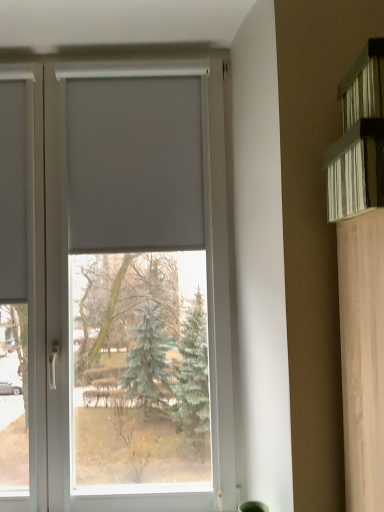
Question: Does white matte blind at center lie in front of white textured shelf at upper right?

Choices:
 (A) no
 (B) yes

Answer: (A)

Question: Is white matte blind at center touching white textured shelf at upper right?

Choices:
 (A) no
 (B) yes

Answer: (A)

Question: Is white matte blind at center not near white textured shelf at upper right?

Choices:
 (A) no
 (B) yes

Answer: (A)

Question: Is white matte blind at center completely or partially outside of white textured shelf at upper right?

Choices:
 (A) no
 (B) yes

Answer: (B)

Question: From the image's perspective, does white matte blind at center appear higher than white textured shelf at upper right?

Choices:
 (A) no
 (B) yes

Answer: (A)

Question: Does white matte blind at center have a lesser height compared to white textured shelf at upper right?

Choices:
 (A) no
 (B) yes

Answer: (A)

Question: Can you confirm if white textured shelf at upper right is thinner than white matte blind at center?

Choices:
 (A) yes
 (B) no

Answer: (B)

Question: Can you confirm if white textured shelf at upper right is shorter than white matte blind at center?

Choices:
 (A) yes
 (B) no

Answer: (A)

Question: Does white textured shelf at upper right have a smaller size compared to white matte blind at center?

Choices:
 (A) yes
 (B) no

Answer: (A)

Question: Is white textured shelf at upper right next to white matte blind at center and touching it?

Choices:
 (A) no
 (B) yes

Answer: (A)

Question: Is the depth of white textured shelf at upper right less than that of white matte blind at center?

Choices:
 (A) yes
 (B) no

Answer: (A)

Question: From a real-world perspective, is white textured shelf at upper right over white matte blind at center?

Choices:
 (A) yes
 (B) no

Answer: (B)

Question: Can you confirm if white matte window at center is taller than white matte blind at center?

Choices:
 (A) yes
 (B) no

Answer: (A)